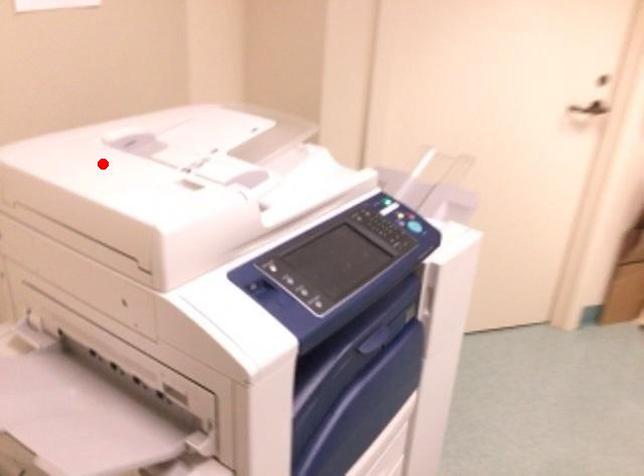
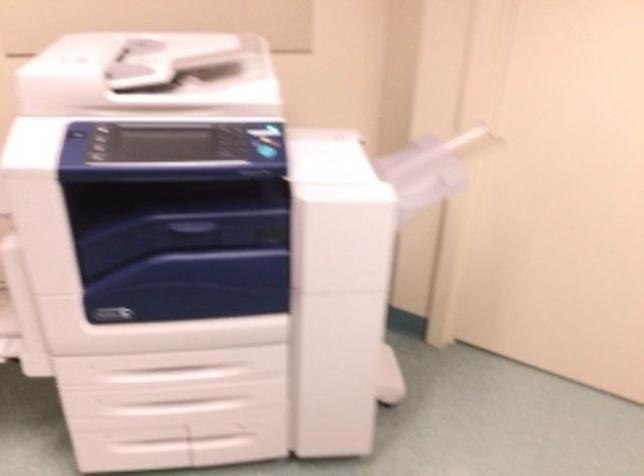
Question: I am providing you with two images of the same scene from different viewpoints. A red point is shown in image1. For the corresponding object point in image2, is it positioned nearer or farther from the camera?

Choices:
 (A) Nearer
 (B) Farther

Answer: (B)